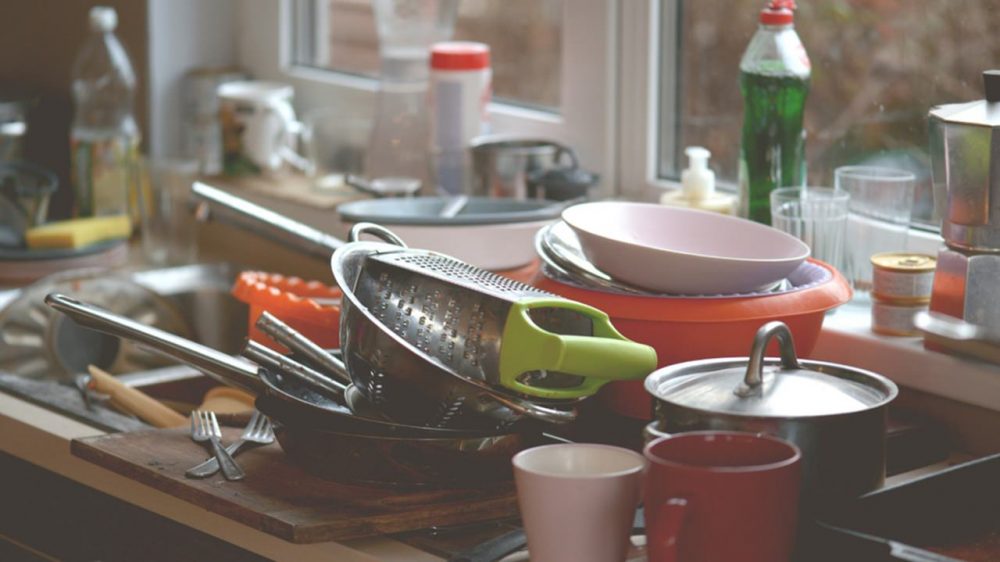
Locate an element on the screen. This screenshot has width=1000, height=562. utensil is located at coordinates [x=277, y=358], [x=281, y=336], [x=216, y=439], [x=254, y=426].